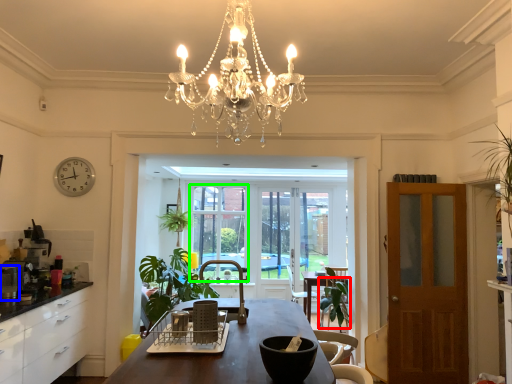
Question: Considering the real-world distances, which object is closest to armchair (highlighted by a red box)? appliance (highlighted by a blue box) or window screen (highlighted by a green box).

Choices:
 (A) appliance
 (B) window screen

Answer: (B)